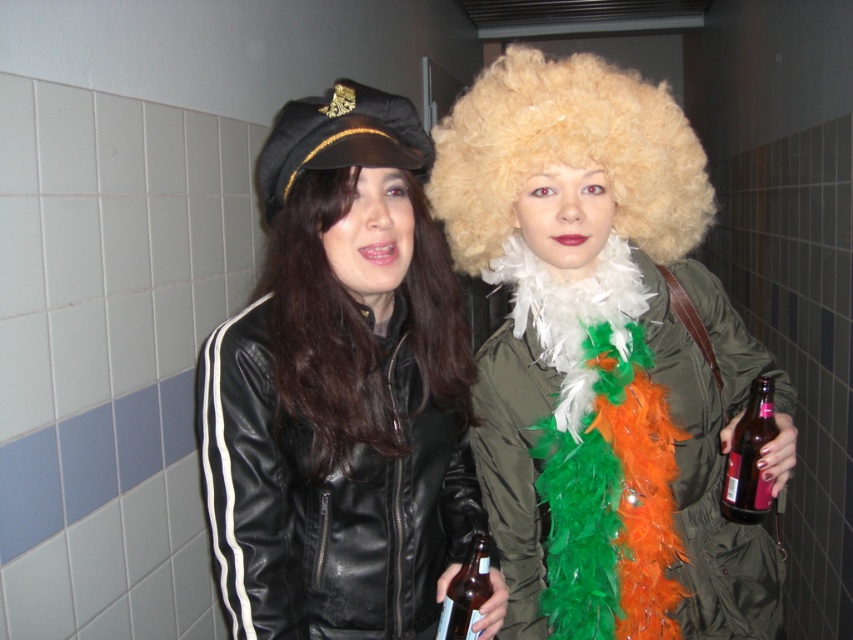
What do you see at coordinates (323, 330) in the screenshot? I see `blonde feather boa at center` at bounding box center [323, 330].

Does blonde feather boa at center appear on the left side of brown glass bottle at right?

Correct, you'll find blonde feather boa at center to the left of brown glass bottle at right.

Measure the distance between point [408,288] and camera.

The distance of point [408,288] from camera is 3.75 feet.

This screenshot has width=853, height=640. Identify the location of blonde feather boa at center. (323, 330).

Between feather boa at center and brown glass bottle at center, which one has more height?

feather boa at center

Is feather boa at center above brown glass bottle at center?

Yes.

Identify the location of feather boa at center. (712, 458).

Between point (376, 476) and point (450, 148), which one is positioned in front?

Point (376, 476) is more forward.

Which is more to the right, black leather jacket at center or blonde curly wig at upper center?

blonde curly wig at upper center is more to the right.

What do you see at coordinates (341, 388) in the screenshot? Image resolution: width=853 pixels, height=640 pixels. I see `black leather jacket at center` at bounding box center [341, 388].

The width and height of the screenshot is (853, 640). Identify the location of black leather jacket at center. (341, 388).